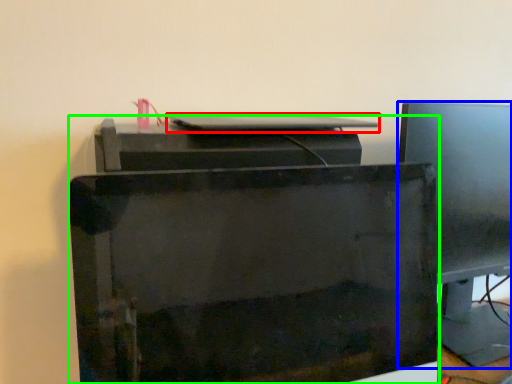
Question: Which object is the closest to the desktop (highlighted by a red box)? Choose among these: computer monitor (highlighted by a blue box) or printer (highlighted by a green box).

Choices:
 (A) computer monitor
 (B) printer

Answer: (B)